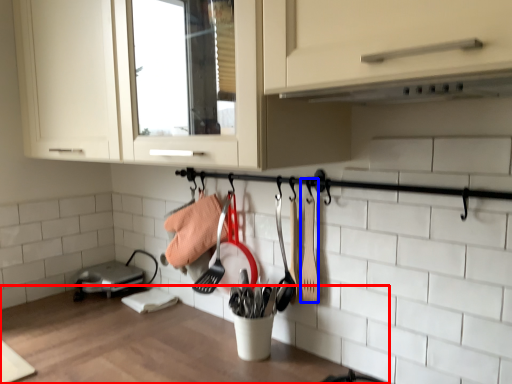
Question: Which point is further to the camera, countertop (highlighted by a red box) or spatula (highlighted by a blue box)?

Choices:
 (A) countertop
 (B) spatula

Answer: (B)